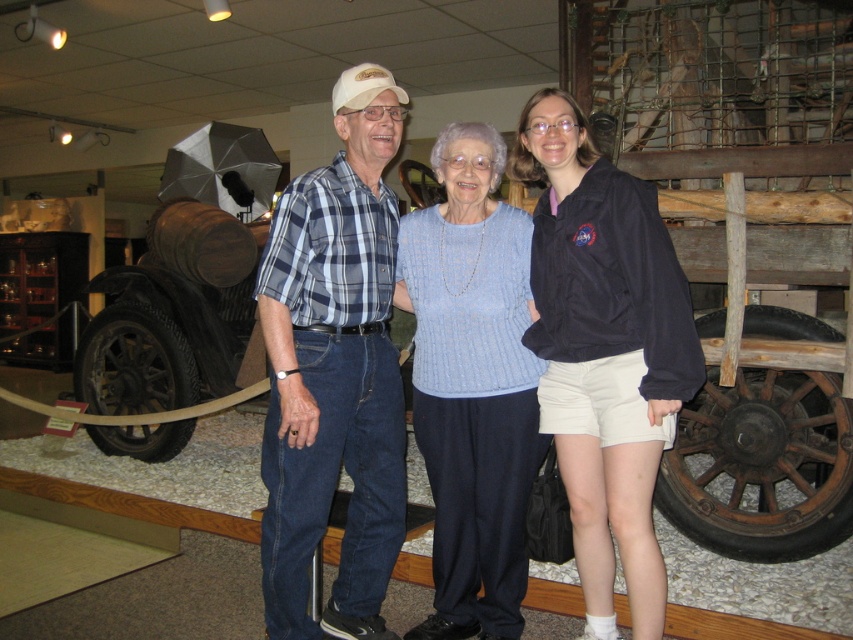
You are a tailor who needs to determine which item, the black fabric jacket at center or the rusty wood wagon at center, requires more vertical space for storage. Based on the scene, which one is taller?

The black fabric jacket at center is taller than the rusty wood wagon at center, so it requires more vertical space for storage.

You are a photographer standing in front of the rusty wood wagon at center. You want to take a picture of the black fabric jacket at center without the wagon being in the frame. Is the jacket positioned in a way that allows this?

The black fabric jacket at center is above the rusty wood wagon at center, so if you angle your camera upwards, you can capture the jacket without the wagon in the frame.

You are a photographer setting up a photo shoot in a museum. You have two props to place in the center of the scene for a balanced composition. The props are the light blue knitted sweater at center and the rusty wood wagon at center. Since you want to ensure they don not overlap, which prop should you place first to account for their sizes?

The rusty wood wagon at center should be placed first because it is wider than the light blue knitted sweater at center, allowing enough space to position both without overlapping.